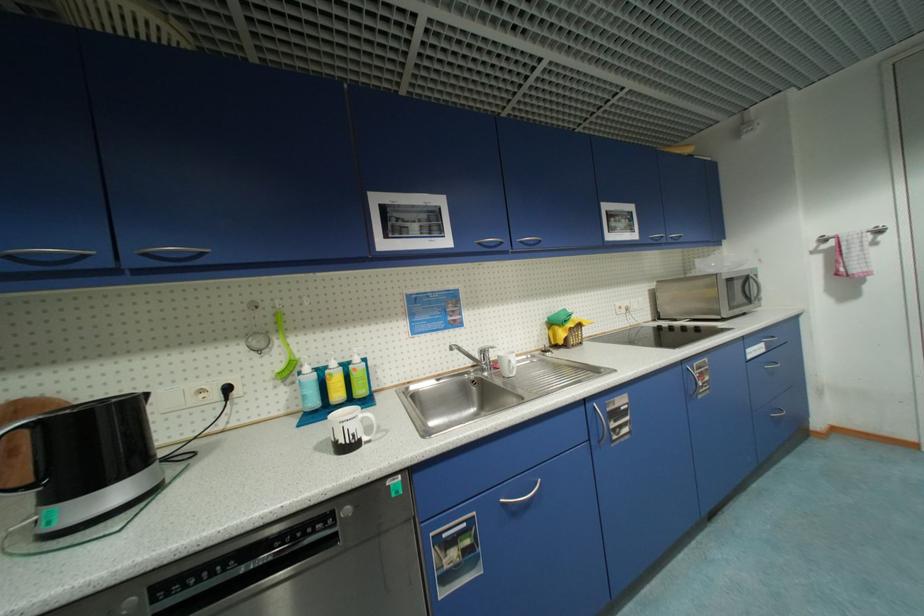
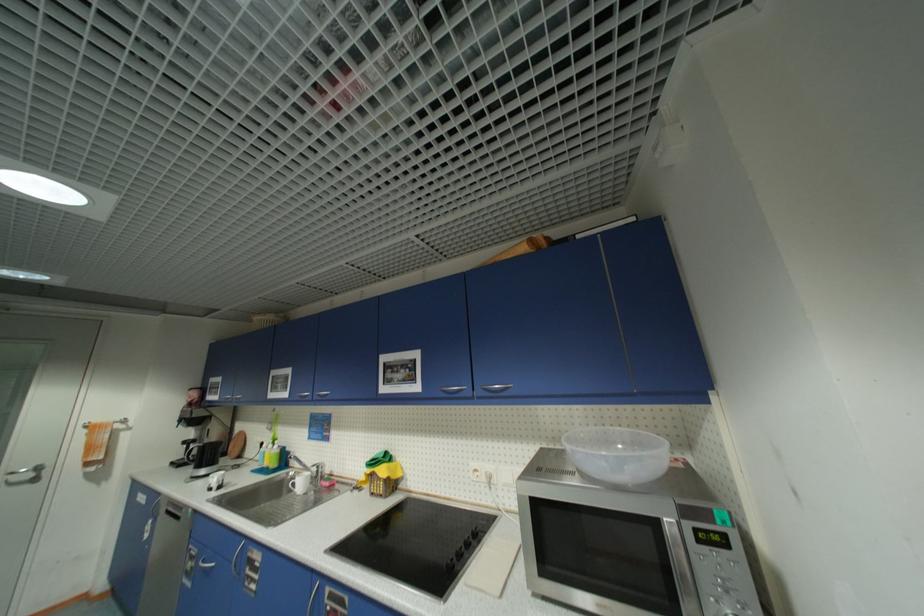
Locate, in the second image, the point that corresponds to point 527,244 in the first image.

(323, 395)